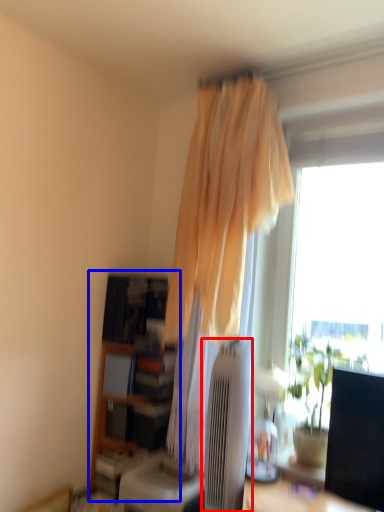
Question: Among these objects, which one is nearest to the camera, air conditioner (highlighted by a red box) or bookshelf (highlighted by a blue box)?

Choices:
 (A) air conditioner
 (B) bookshelf

Answer: (A)